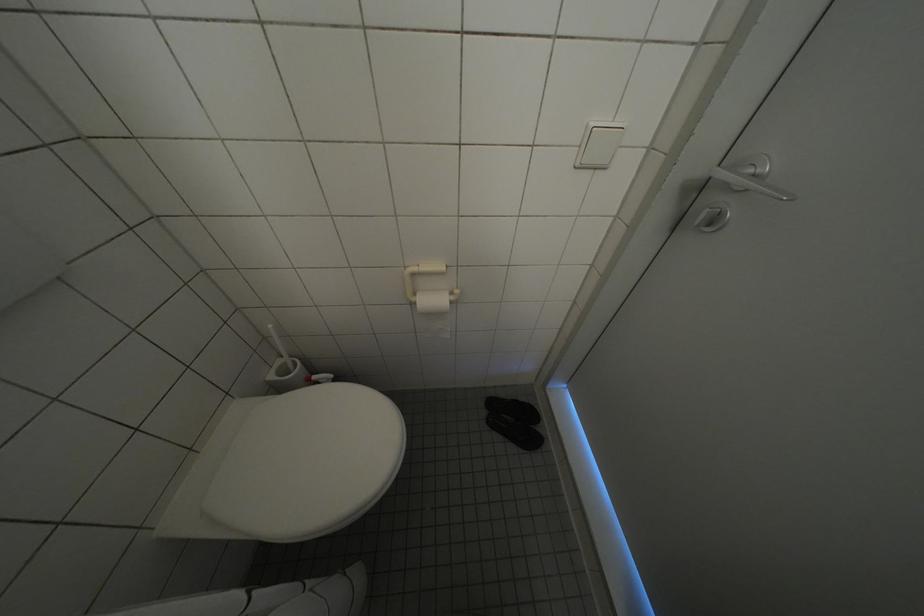
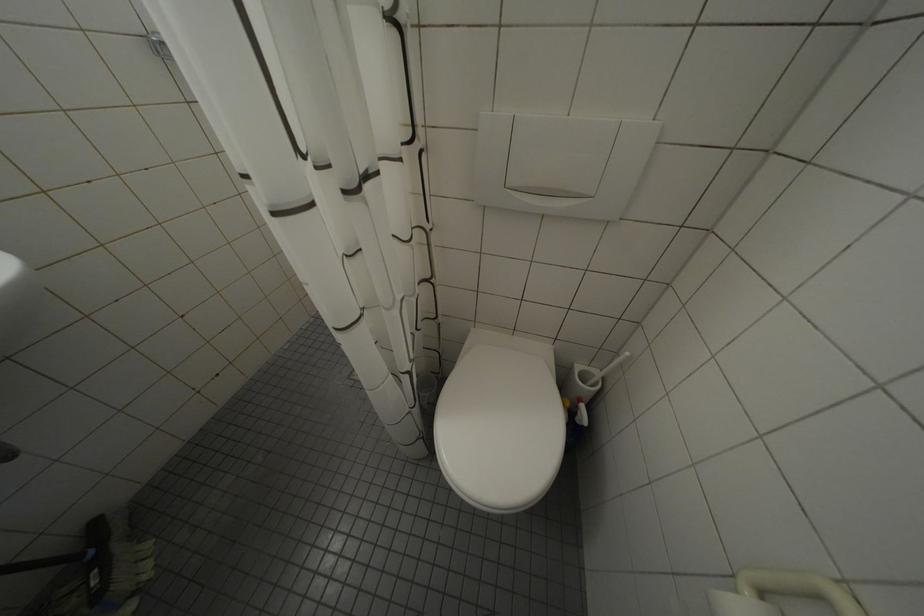
First-person continuous shooting, in which direction is the camera rotating?

The camera rotated toward left-down.